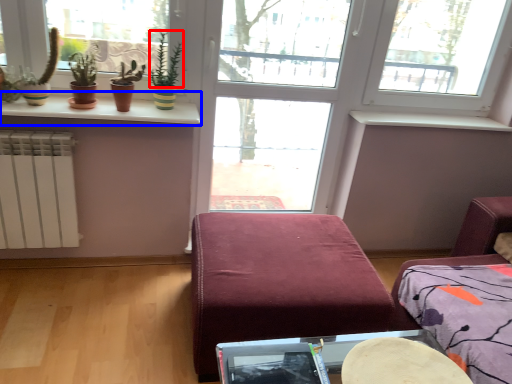
Question: Which of the following is the closest to the observer, plant (highlighted by a red box) or window sill (highlighted by a blue box)?

Choices:
 (A) plant
 (B) window sill

Answer: (B)